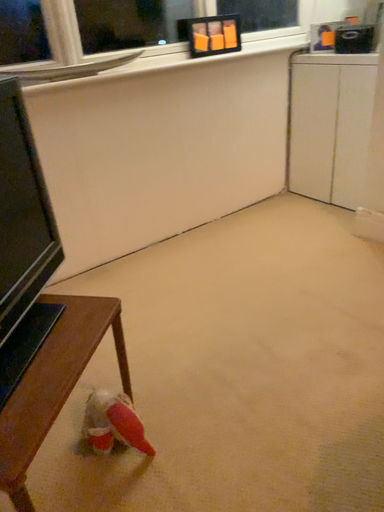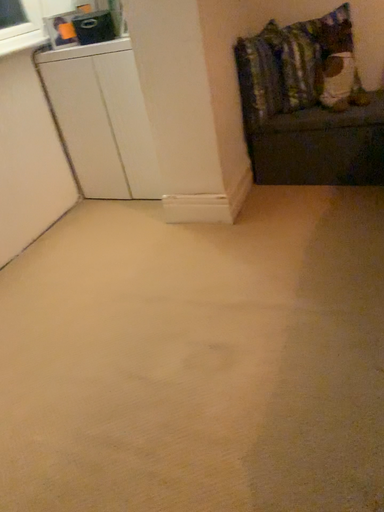
Question: Which way did the camera rotate in the video?

Choices:
 (A) rotated left
 (B) rotated right

Answer: (B)